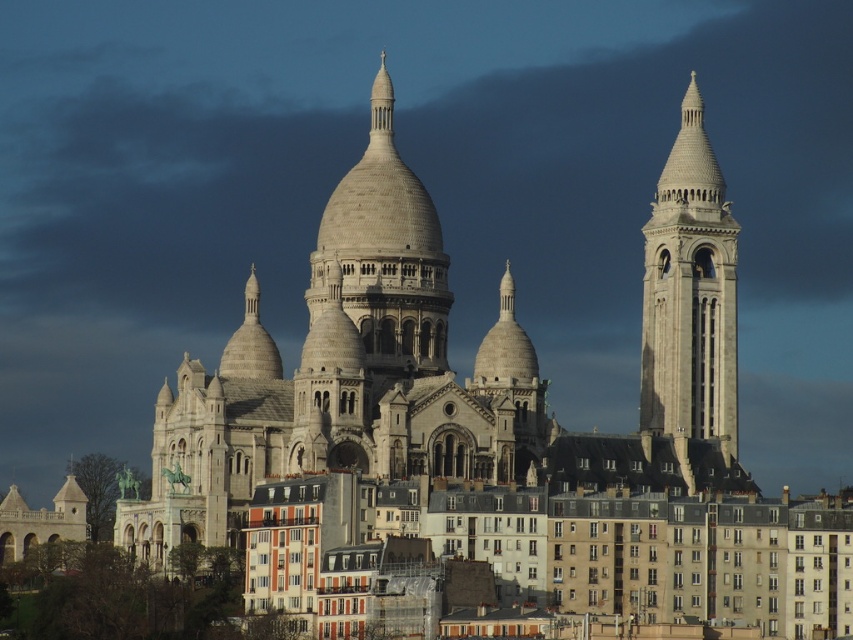
Question: Can you confirm if white stone tower at right is bigger than beige stone dome at center?

Choices:
 (A) yes
 (B) no

Answer: (A)

Question: Which object is closer to the camera taking this photo?

Choices:
 (A) white stone tower at right
 (B) beige stone dome at center

Answer: (A)

Question: Which of the following is the closest to the observer?

Choices:
 (A) beige stone dome at center
 (B) white stone tower at right

Answer: (B)

Question: Does white stone tower at right have a larger size compared to beige stone dome at center?

Choices:
 (A) yes
 (B) no

Answer: (A)

Question: Is white stone tower at right wider than beige stone dome at center?

Choices:
 (A) no
 (B) yes

Answer: (A)

Question: Which point is closer to the camera?

Choices:
 (A) beige stone dome at center
 (B) white stone tower at right

Answer: (B)